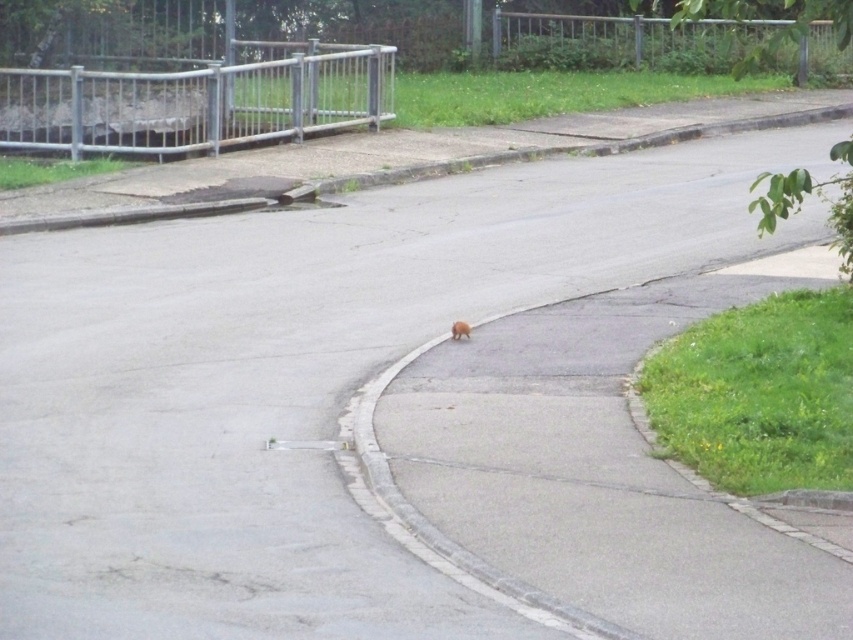
You are standing at the camera position and want to place a 20 meter long fence along the gray concrete curb at upper center. Is the curb long enough to accommodate the fence?

The gray concrete curb at upper center is 17.99 meters away from camera, so the curb is shorter than the 20 meter fence. Therefore, the curb is not long enough to accommodate the fence.